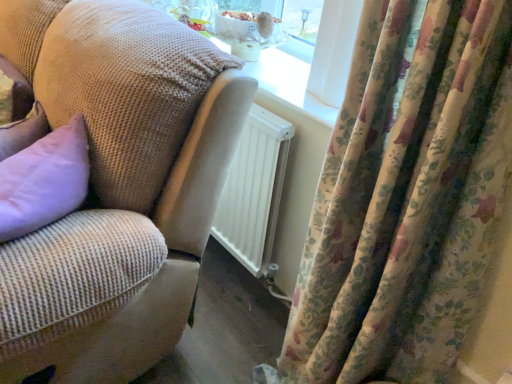
Describe the element at coordinates (406, 199) in the screenshot. The image size is (512, 384). I see `floral velvet curtains at right` at that location.

You are a GUI agent. You are given a task and a screenshot of the screen. Output one action in this format:
    pyautogui.click(x=<x>, y=<y>)
    Task: Click on the floral velvet curtains at right
    This screenshot has width=512, height=384.
    Given the screenshot: What is the action you would take?
    pyautogui.click(x=406, y=199)

Measure the distance between floral velvet curtains at right and camera.

floral velvet curtains at right is 25.37 inches from camera.

In order to click on woven fabric couch at center in this screenshot , I will do `click(116, 185)`.

The image size is (512, 384). Describe the element at coordinates (116, 185) in the screenshot. I see `woven fabric couch at center` at that location.

I want to click on floral velvet curtains at right, so click(x=406, y=199).

Is floral velvet curtains at right to the right of woven fabric couch at center from the viewer's perspective?

Correct, you'll find floral velvet curtains at right to the right of woven fabric couch at center.

Which is in front, floral velvet curtains at right or woven fabric couch at center?

floral velvet curtains at right is more forward.

Does point (493, 120) appear closer or farther from the camera than point (45, 122)?

Point (493, 120) is positioned closer to the camera compared to point (45, 122).

From the image's perspective, relative to woven fabric couch at center, is floral velvet curtains at right above or below?

Clearly, from the image's perspective, floral velvet curtains at right is below woven fabric couch at center.

From a real-world perspective, is floral velvet curtains at right below woven fabric couch at center?

Actually, floral velvet curtains at right is physically above woven fabric couch at center in the real world.

Considering the relative sizes of floral velvet curtains at right and woven fabric couch at center in the image provided, is floral velvet curtains at right thinner than woven fabric couch at center?

Yes.

Based on the photo, considering the sizes of objects floral velvet curtains at right and woven fabric couch at center in the image provided, who is shorter, floral velvet curtains at right or woven fabric couch at center?

woven fabric couch at center is shorter.

Based on their sizes in the image, would you say floral velvet curtains at right is bigger or smaller than woven fabric couch at center?

In the image, floral velvet curtains at right appears to be smaller than woven fabric couch at center.

Is woven fabric couch at center surrounded by floral velvet curtains at right?

No, floral velvet curtains at right does not contain woven fabric couch at center.

Is floral velvet curtains at right far away from woven fabric couch at center?

No, there isn't a large distance between floral velvet curtains at right and woven fabric couch at center.

Is floral velvet curtains at right facing towards woven fabric couch at center?

No, floral velvet curtains at right is not oriented towards woven fabric couch at center.

What's the angular difference between floral velvet curtains at right and woven fabric couch at center's facing directions?

0.694 degrees.

Identify the location of studio couch on the left of floral velvet curtains at right. This screenshot has height=384, width=512. click(x=116, y=185).

Is woven fabric couch at center to the right of floral velvet curtains at right from the viewer's perspective?

Incorrect, woven fabric couch at center is not on the right side of floral velvet curtains at right.

Is woven fabric couch at center behind floral velvet curtains at right?

Yes, woven fabric couch at center is further from the viewer.

Between point (139, 99) and point (370, 324), which one is positioned behind?

The point (139, 99) is behind.

From the image's perspective, is woven fabric couch at center positioned above or below floral velvet curtains at right?

woven fabric couch at center is above floral velvet curtains at right.

From a real-world perspective, relative to floral velvet curtains at right, is woven fabric couch at center vertically above or below?

From a real-world perspective, woven fabric couch at center is physically below floral velvet curtains at right.

Which object is wider, woven fabric couch at center or floral velvet curtains at right?

woven fabric couch at center is wider.

Consider the image. Who is taller, woven fabric couch at center or floral velvet curtains at right?

With more height is floral velvet curtains at right.

Is woven fabric couch at center bigger than floral velvet curtains at right?

Yes.

Would you say floral velvet curtains at right is part of woven fabric couch at center's contents?

No.

Is woven fabric couch at center far away from floral velvet curtains at right?

No, woven fabric couch at center is in close proximity to floral velvet curtains at right.

Is woven fabric couch at center facing away from floral velvet curtains at right?

No, woven fabric couch at center is not facing away from floral velvet curtains at right.

How different are the orientations of woven fabric couch at center and floral velvet curtains at right in degrees?

0.694 degrees.

The image size is (512, 384). I want to click on curtain in front of the woven fabric couch at center, so [406, 199].

Find the location of a particular element. curtain located above the woven fabric couch at center (from a real-world perspective) is located at coordinates (406, 199).

Identify the location of studio couch above the floral velvet curtains at right (from the image's perspective). (116, 185).